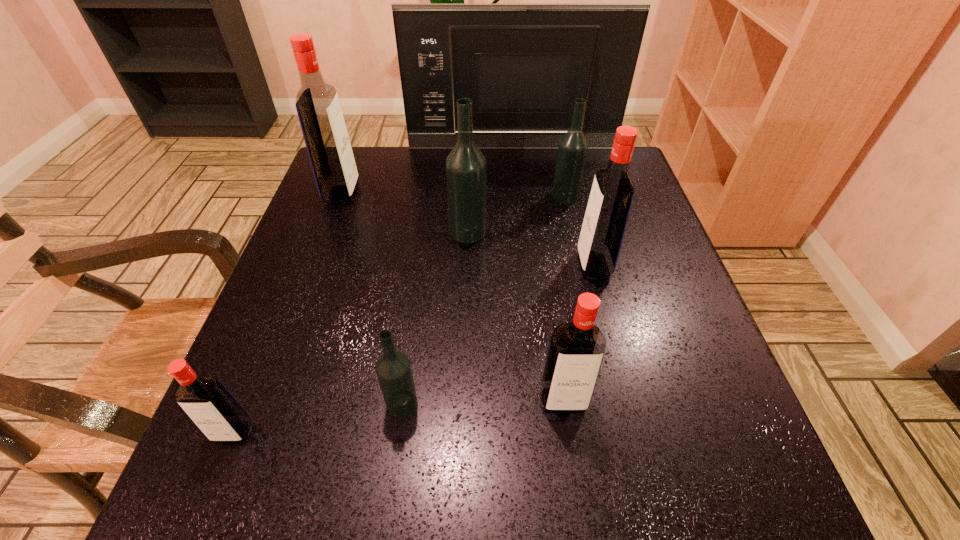
Find the location of a particular element. The width and height of the screenshot is (960, 540). microwave oven is located at coordinates (523, 66).

What are the coordinates of `dark microwave oven` in the screenshot? It's located at (523, 66).

Locate an element on the screen. The height and width of the screenshot is (540, 960). the biggest red vodka is located at coordinates (317, 103).

Where is `the farthest red vodka`? The image size is (960, 540). the farthest red vodka is located at coordinates (317, 103).

Where is `the second farthest black vodka`? Image resolution: width=960 pixels, height=540 pixels. the second farthest black vodka is located at coordinates (466, 169).

What are the coordinates of `the fourth vodka from right to left` in the screenshot? It's located at (466, 169).

Find the location of `the fourth nearest vodka`. the fourth nearest vodka is located at coordinates [x=606, y=216].

Where is `the fourth nearest object`? The height and width of the screenshot is (540, 960). the fourth nearest object is located at coordinates (606, 216).

This screenshot has width=960, height=540. What are the coordinates of `the farthest black vodka` in the screenshot? It's located at (572, 149).

At what (x,y) coordinates should I click in order to perform the action: click on the rightmost black vodka. Please return your answer as a coordinate pair (x, y). The height and width of the screenshot is (540, 960). Looking at the image, I should click on (572, 149).